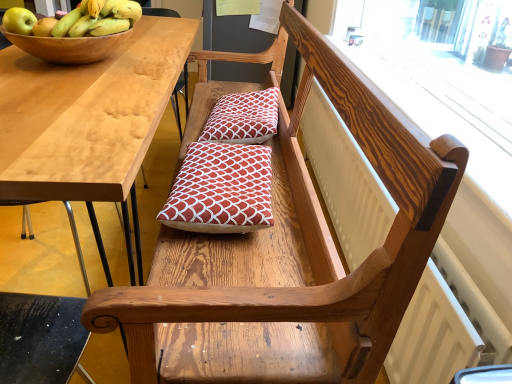
Question: Considering the positions of green matte apple at upper left and red printed cushion at center, which is counted as the second pillow, starting from the front, in the image, is green matte apple at upper left wider or thinner than red printed cushion at center, which is counted as the second pillow, starting from the front,?

Choices:
 (A) thin
 (B) wide

Answer: (A)

Question: Is green matte apple at upper left inside or outside of red printed cushion at center, the 1th pillow in the back-to-front sequence?

Choices:
 (A) inside
 (B) outside

Answer: (B)

Question: Estimate the real-world distances between objects in this image. Which object is farther from the yellow matte bananas at upper left?

Choices:
 (A) red printed cushion at center, the 1th pillow in the back-to-front sequence
 (B) wooden bowl at upper left
 (C) red printed cushion at center, the 2th pillow when ordered from back to front
 (D) white textured radiator at upper right
 (E) light wood table at left

Answer: (D)

Question: Considering the real-world distances, which object is farthest from the red printed cushion at center, the 2th pillow when ordered from back to front?

Choices:
 (A) red printed cushion at center, which is counted as the second pillow, starting from the front
 (B) green matte apple at upper left
 (C) yellow matte bananas at upper left
 (D) white textured radiator at upper right
 (E) wooden bowl at upper left

Answer: (B)